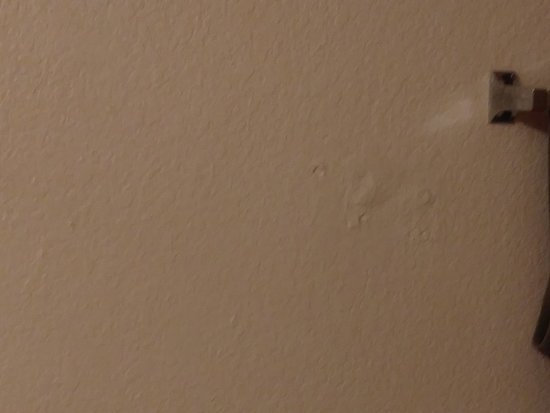
The height and width of the screenshot is (413, 550). Identify the location of sides of towel rack mount. (502, 122), (491, 100), (503, 71).